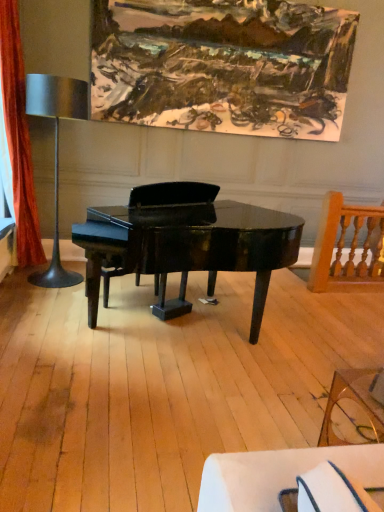
Question: Would you say metallic silver table lamp at left contains wooden spindle chair at right?

Choices:
 (A) yes
 (B) no

Answer: (B)

Question: Considering the relative sizes of metallic silver table lamp at left and wooden spindle chair at right in the image provided, is metallic silver table lamp at left wider than wooden spindle chair at right?

Choices:
 (A) no
 (B) yes

Answer: (B)

Question: From a real-world perspective, is metallic silver table lamp at left on top of wooden spindle chair at right?

Choices:
 (A) no
 (B) yes

Answer: (B)

Question: Does metallic silver table lamp at left have a greater height compared to wooden spindle chair at right?

Choices:
 (A) yes
 (B) no

Answer: (A)

Question: Is metallic silver table lamp at left positioned far away from wooden spindle chair at right?

Choices:
 (A) yes
 (B) no

Answer: (A)

Question: Is metallic silver table lamp at left positioned beyond the bounds of wooden spindle chair at right?

Choices:
 (A) yes
 (B) no

Answer: (A)

Question: Can you confirm if oil paint canvas at upper center is smaller than metallic silver table lamp at left?

Choices:
 (A) yes
 (B) no

Answer: (A)

Question: Is oil paint canvas at upper center closer to camera compared to metallic silver table lamp at left?

Choices:
 (A) yes
 (B) no

Answer: (B)

Question: Can you confirm if oil paint canvas at upper center is taller than metallic silver table lamp at left?

Choices:
 (A) no
 (B) yes

Answer: (A)

Question: Is oil paint canvas at upper center behind metallic silver table lamp at left?

Choices:
 (A) yes
 (B) no

Answer: (A)

Question: Considering the relative sizes of oil paint canvas at upper center and metallic silver table lamp at left in the image provided, is oil paint canvas at upper center thinner than metallic silver table lamp at left?

Choices:
 (A) yes
 (B) no

Answer: (A)

Question: Is oil paint canvas at upper center oriented towards metallic silver table lamp at left?

Choices:
 (A) yes
 (B) no

Answer: (B)

Question: From the image's perspective, is oil paint canvas at upper center beneath transparent glass coffee table at lower right?

Choices:
 (A) yes
 (B) no

Answer: (B)